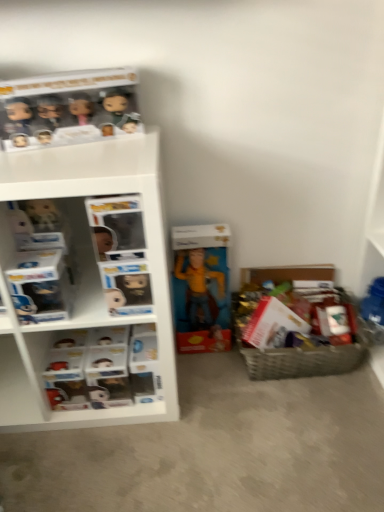
This screenshot has height=512, width=384. What are the coordinates of `free space on the front side of matte black figurines at upper left` in the screenshot? It's located at click(x=72, y=167).